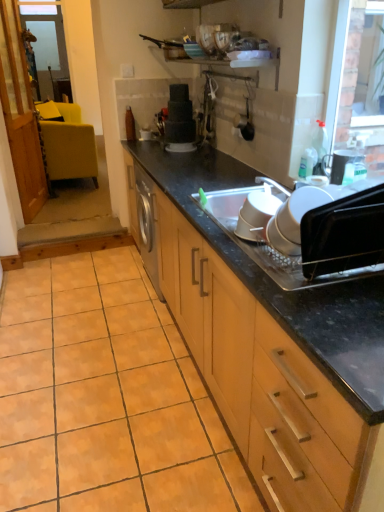
The image size is (384, 512). Identify the location of blank space above orange matte tile at lower left (from a real-world perspective). (89, 346).